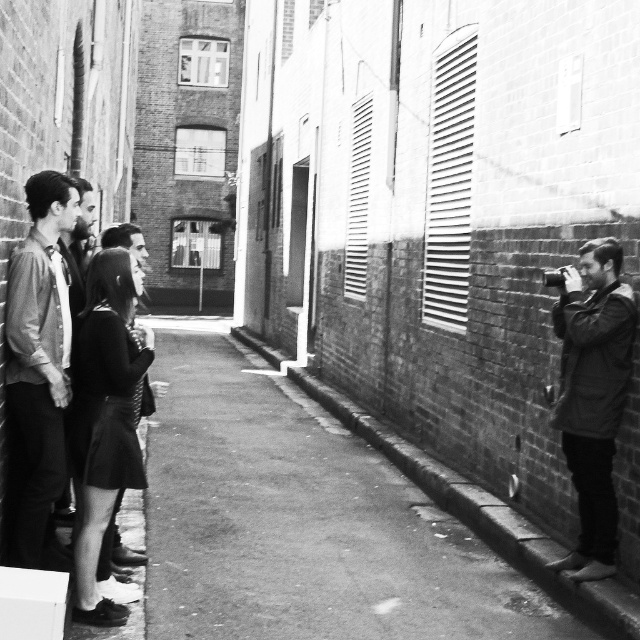
Question: Is denim shirt at left further to camera compared to dark gray coat at right?

Choices:
 (A) yes
 (B) no

Answer: (B)

Question: Among these points, which one is nearest to the camera?

Choices:
 (A) (483, 536)
 (B) (579, 504)
 (C) (42, 321)

Answer: (C)

Question: Which point appears closest to the camera in this image?

Choices:
 (A) (584, 598)
 (B) (592, 509)

Answer: (A)

Question: Where is denim shirt at left located in relation to smooth concrete curb at lower right in the image?

Choices:
 (A) left
 (B) right

Answer: (A)

Question: Which object appears farthest from the camera in this image?

Choices:
 (A) smooth concrete curb at lower right
 (B) dark gray coat at right

Answer: (B)

Question: Is denim shirt at left above smooth concrete curb at lower right?

Choices:
 (A) yes
 (B) no

Answer: (A)